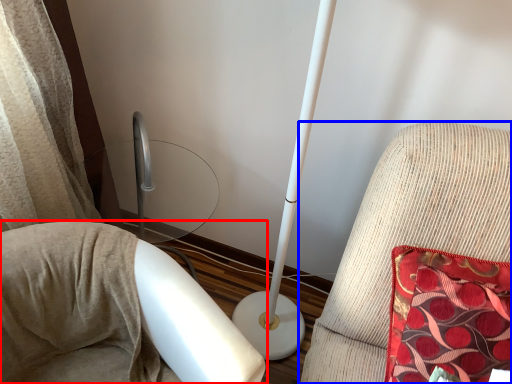
Question: Which of the following is the closest to the observer, furniture (highlighted by a red box) or furniture (highlighted by a blue box)?

Choices:
 (A) furniture
 (B) furniture

Answer: (A)